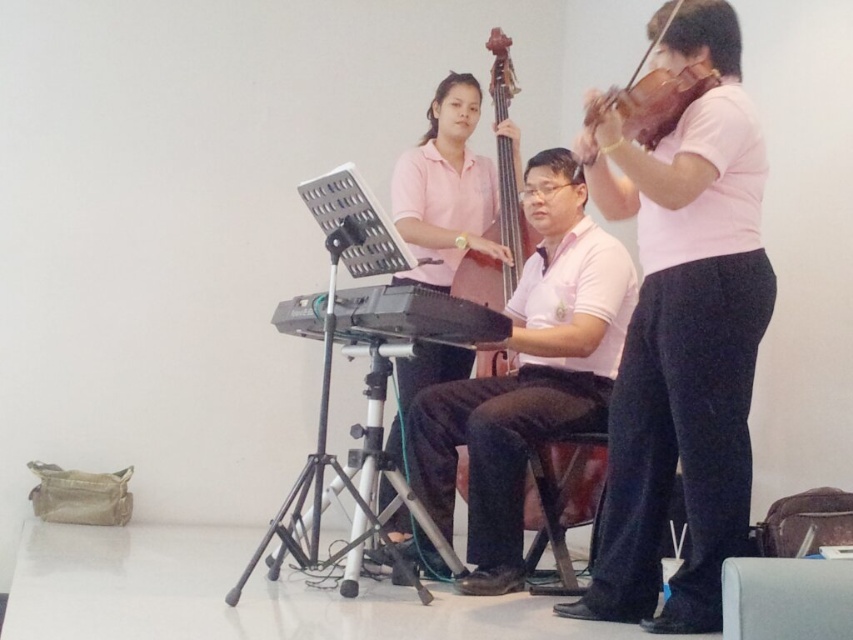
Who is more forward, (656, 490) or (444, 182)?

Positioned in front is point (656, 490).

Does pink cotton shirt at upper right lie in front of pink cotton shirt at center?

Yes, pink cotton shirt at upper right is in front of pink cotton shirt at center.

Locate an element on the screen. pink cotton shirt at upper right is located at coordinates (682, 333).

Image resolution: width=853 pixels, height=640 pixels. I want to click on pink cotton shirt at upper right, so click(x=682, y=333).

Can you confirm if pink cotton shirt at upper right is positioned to the right of matte black cello at center?

Yes, pink cotton shirt at upper right is to the right of matte black cello at center.

Based on the photo, is pink cotton shirt at upper right above matte black cello at center?

No.

Where is `pink cotton shirt at upper right`? This screenshot has height=640, width=853. pink cotton shirt at upper right is located at coordinates (682, 333).

This screenshot has width=853, height=640. What are the coordinates of `pink cotton shirt at upper right` in the screenshot? It's located at (682, 333).

Which is more to the right, pink cotton shirt at center or matte black cello at center?

matte black cello at center

You are a GUI agent. You are given a task and a screenshot of the screen. Output one action in this format:
    pyautogui.click(x=<x>, y=<y>)
    Task: Click on the pink cotton shirt at center
    
    Given the screenshot: What is the action you would take?
    pyautogui.click(x=445, y=189)

Is point (461, 250) positioned in front of point (479, 269)?

No, it is not.

Locate an element on the screen. pink cotton shirt at center is located at coordinates (445, 189).